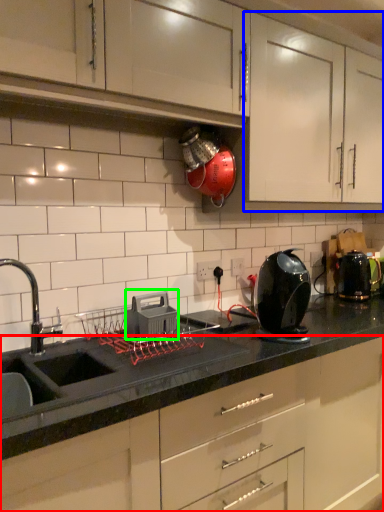
Question: Estimate the real-world distances between objects in this image. Which object is closer to cabinetry (highlighted by a red box), cabinetry (highlighted by a blue box) or appliance (highlighted by a green box)?

Choices:
 (A) cabinetry
 (B) appliance

Answer: (B)